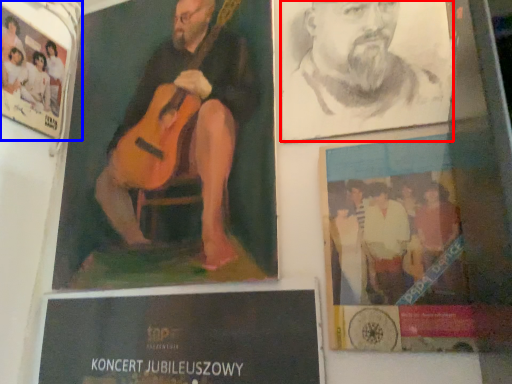
Question: Which point is closer to the camera, man (highlighted by a red box) or poster (highlighted by a blue box)?

Choices:
 (A) man
 (B) poster

Answer: (A)